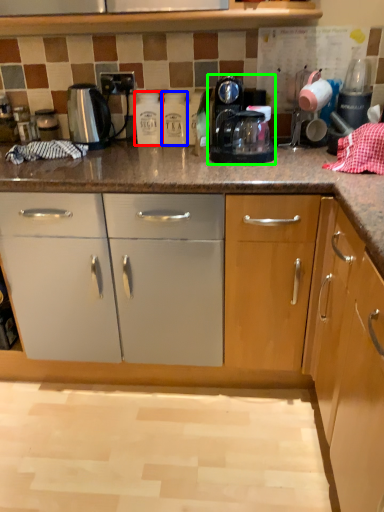
Question: Based on their relative distances, which object is farther from bottle (highlighted by a red box)? Choose from bottle (highlighted by a blue box) and home appliance (highlighted by a green box).

Choices:
 (A) bottle
 (B) home appliance

Answer: (B)